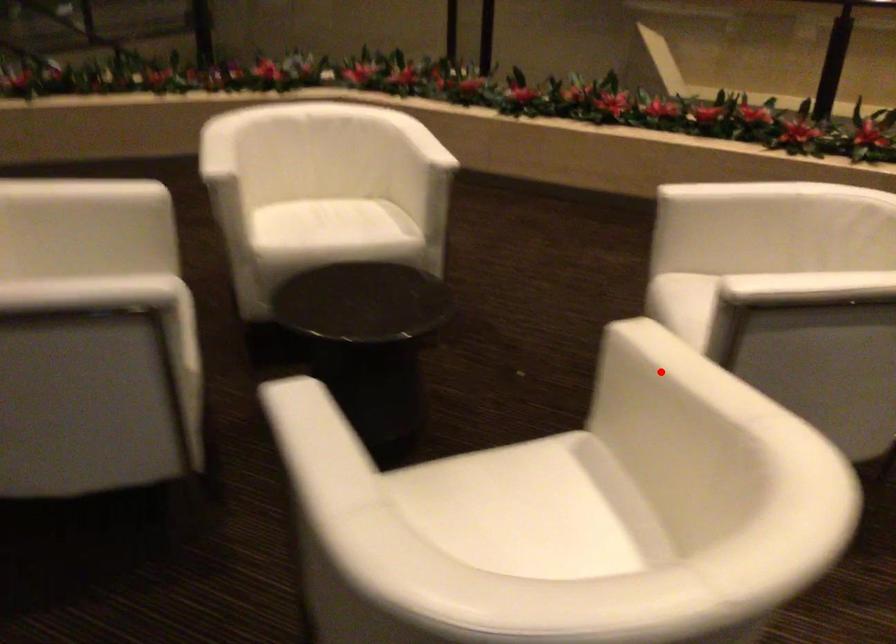
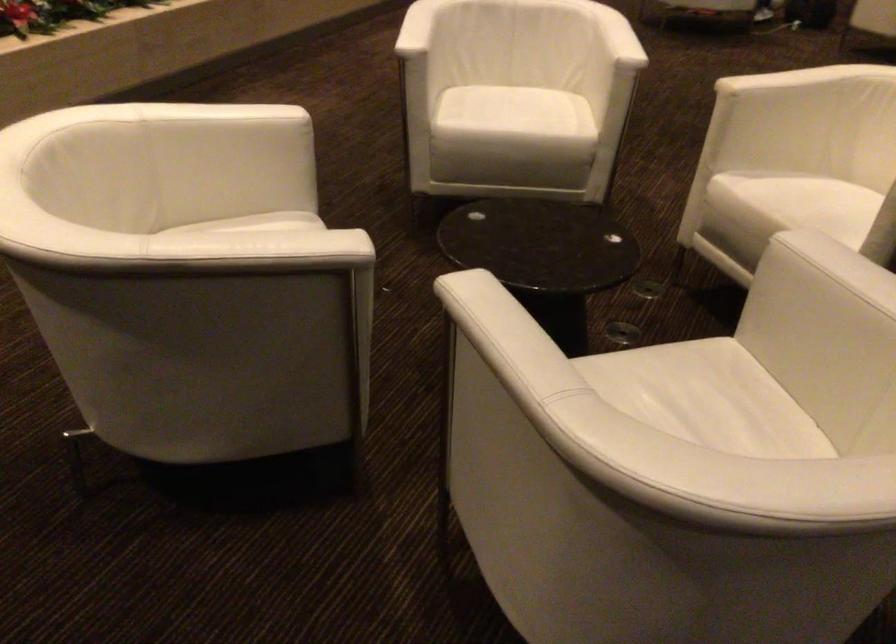
Question: I am providing you with two images of the same scene from different viewpoints. Given a red point in image1, look at the same physical point in image2. Is it:

Choices:
 (A) Closer to the viewpoint
 (B) Farther from the viewpoint

Answer: (B)